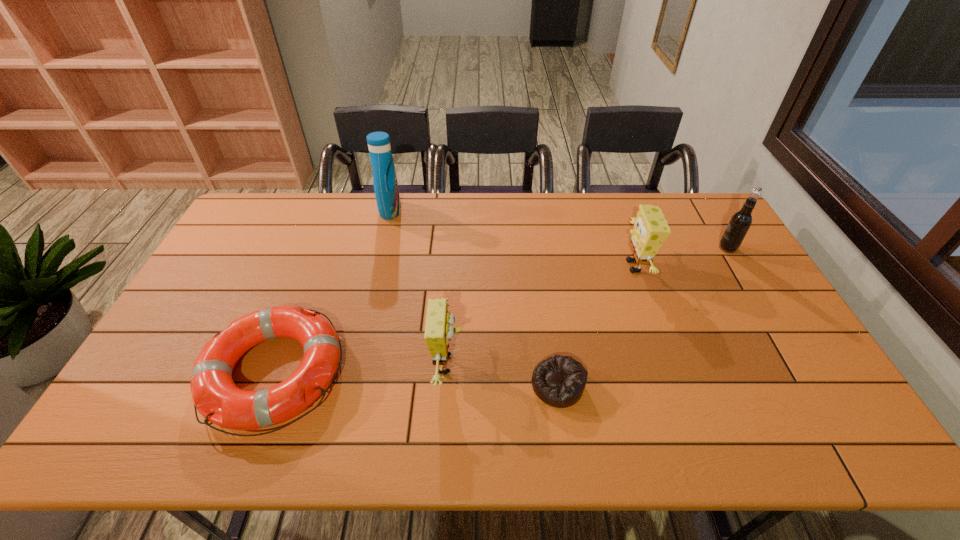
At what (x,y) coordinates should I click in order to perform the action: click on free location that satisfies the following two spatial constraints: 1. on the face of the fourth object from right to left; 2. on the front side of the life buoy. Please return your answer as a coordinate pair (x, y). The width and height of the screenshot is (960, 540). Looking at the image, I should click on (447, 373).

This screenshot has height=540, width=960. In order to click on vacant region that satisfies the following two spatial constraints: 1. on the label of the root beer; 2. on the front side of the fifth tallest object in this screenshot , I will do `click(802, 373)`.